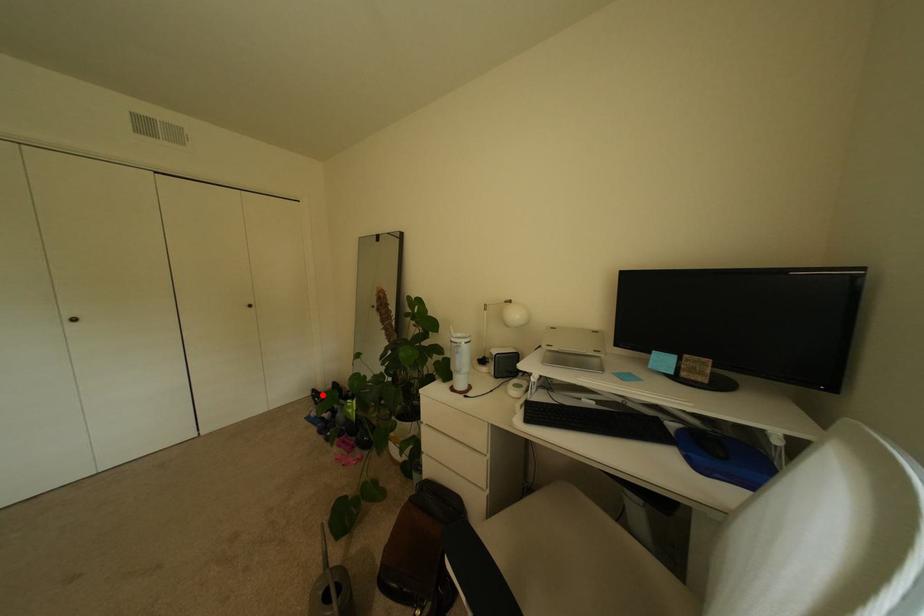
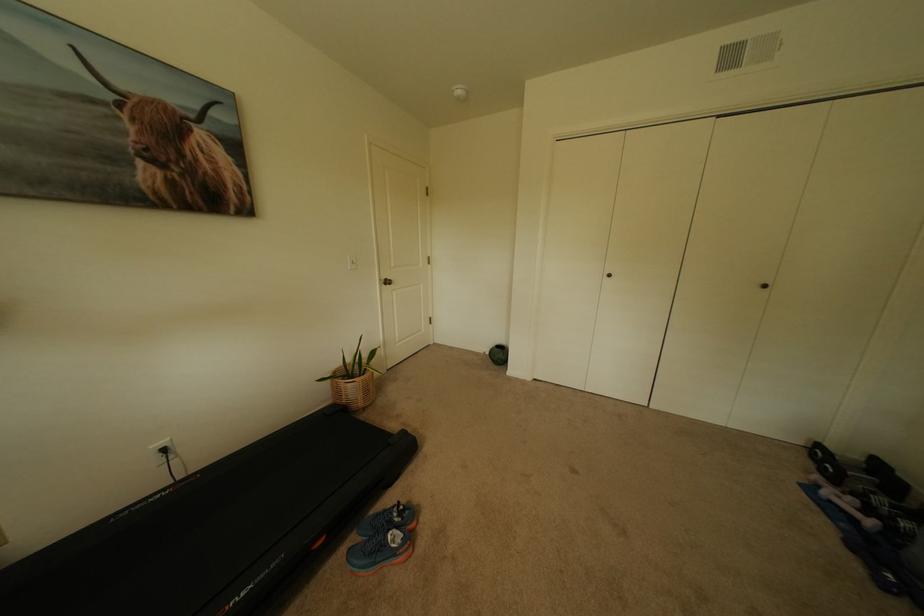
Where in the second image is the point corresponding to the highlighted location from the first image?

(827, 452)